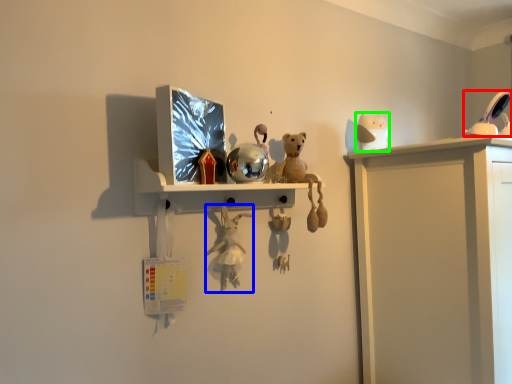
Question: Which object is positioned closest to toy (highlighted by a red box)? Select from toy (highlighted by a blue box) and toy (highlighted by a green box).

Choices:
 (A) toy
 (B) toy

Answer: (B)